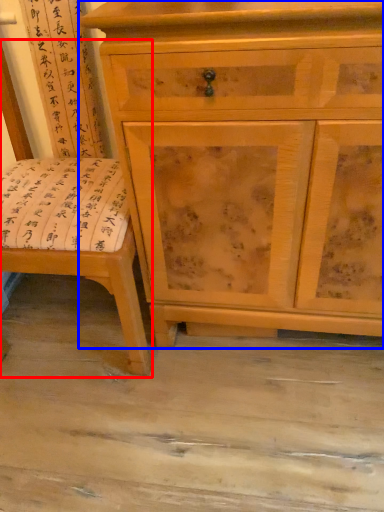
Question: Which point is closer to the camera, swivel chair (highlighted by a red box) or chest of drawers (highlighted by a blue box)?

Choices:
 (A) swivel chair
 (B) chest of drawers

Answer: (A)